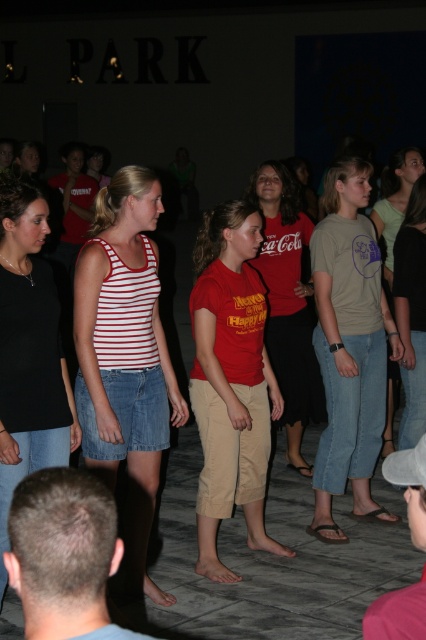
Question: Is light brown cotton shirt at center further to camera compared to black matte tank top at center?

Choices:
 (A) yes
 (B) no

Answer: (A)

Question: Which of the following is the farthest from the observer?

Choices:
 (A) striped cotton tank top at center
 (B) denim skirt at center

Answer: (B)

Question: Which object is positioned farthest from the matte red t-shirt at center?

Choices:
 (A) denim skirt at center
 (B) black matte tank top at center
 (C) light brown cotton shirt at center

Answer: (A)

Question: Is matte red t-shirt at center positioned behind matte red shirt at center?

Choices:
 (A) yes
 (B) no

Answer: (B)

Question: Is light brown cotton shirt at center in front of black matte tank top at center?

Choices:
 (A) no
 (B) yes

Answer: (A)

Question: Estimate the real-world distances between objects in this image. Which object is closer to the matte red shirt at center?

Choices:
 (A) light brown cotton shirt at center
 (B) matte red t-shirt at center

Answer: (A)